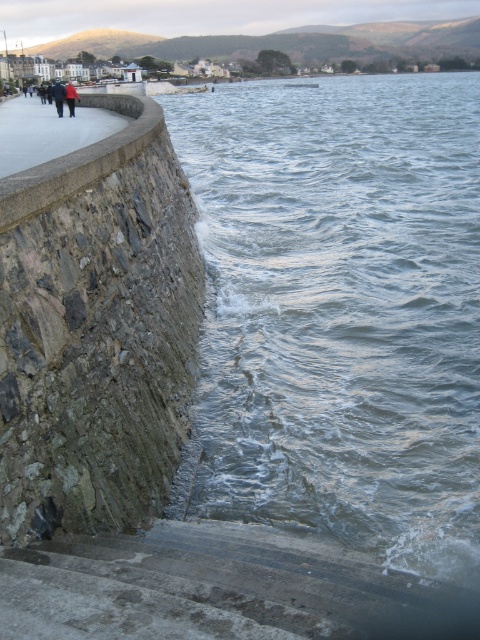
You are standing at the base of the gray stone wall at left and want to reach the point marked at coordinates (x=96, y=330). Can you walk directly to that point along the wall?

The point at (x=96, y=330) is on the gray stone wall at left, so you can walk directly to that point along the wall.

You are standing at the base of the stone wall near the water in the coastal scene. You see two points marked on the image. The first point is at coordinates point (x=323, y=512) and the second point is at point (x=124, y=118). Which point is closer to you from your current position?

Point (x=323, y=512) is in front of point (x=124, y=118), so it is closer to you.